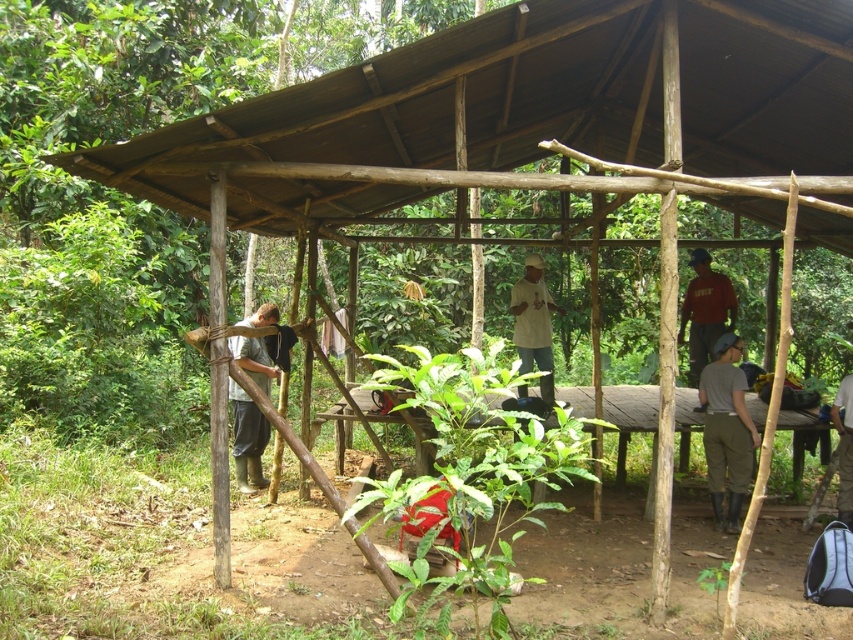
You are a photographer trying to capture both the green matte shirt at left and the dark red shirt at center in the same frame. Since you want to ensure both are clearly visible, which shirt should you focus on first to avoid blurring due to their sizes?

The green matte shirt at left is smaller than the dark red shirt at center, so you should focus on the dark red shirt at center first to ensure clarity, as it is larger and might require more precise focusing.

You are a tailor assessing clothing sizes. You see a green matte shirt at left and a white matte shirt at center in the scene. Which shirt has a larger size?

The white matte shirt at center is larger in size since its width is greater than the green matte shirt at left.

You are a photographer planning to take a group photo of the people inside the shelter. The green matte shirt at left and the dark red shirt at center are the main subjects. Since you want to ensure both are visible in the frame, which subject should you position closer to the camera to avoid being cropped out?

The dark red shirt at center should be positioned closer to the camera because the green matte shirt at left is much taller than the dark red shirt at center. This way, the shorter dark red shirt at center can be seen without being obscured by the taller green matte shirt at left.